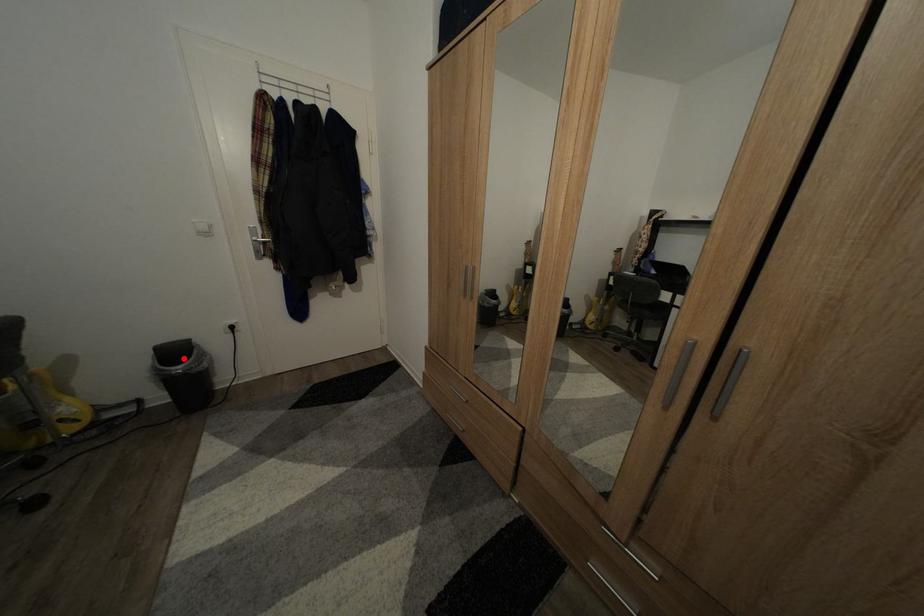
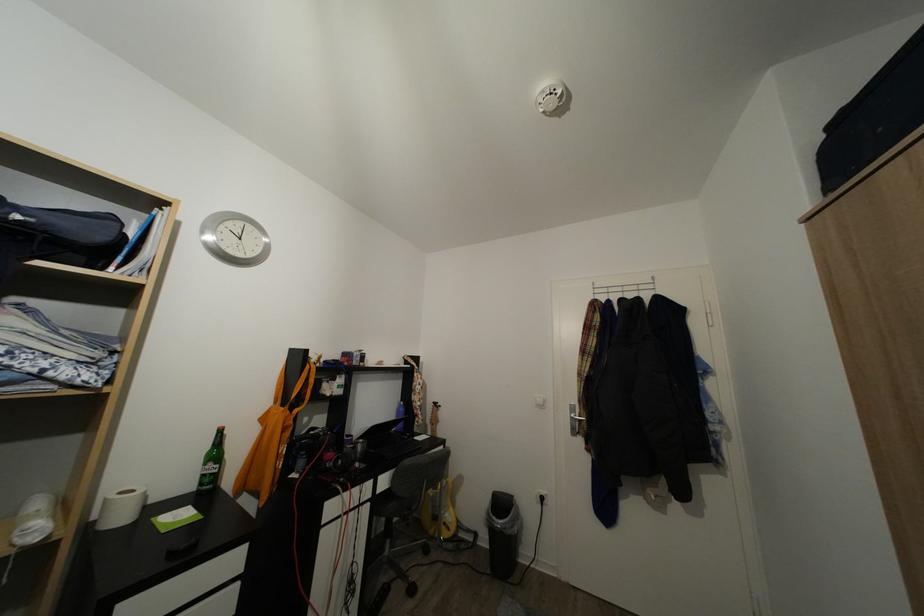
In the second image, find the point that corresponds to the highlighted location in the first image.

(509, 511)